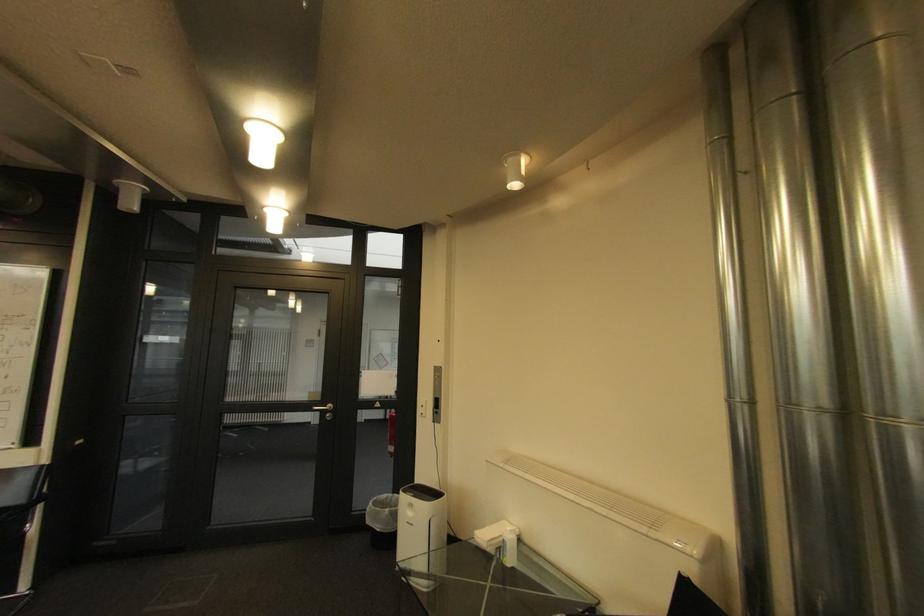
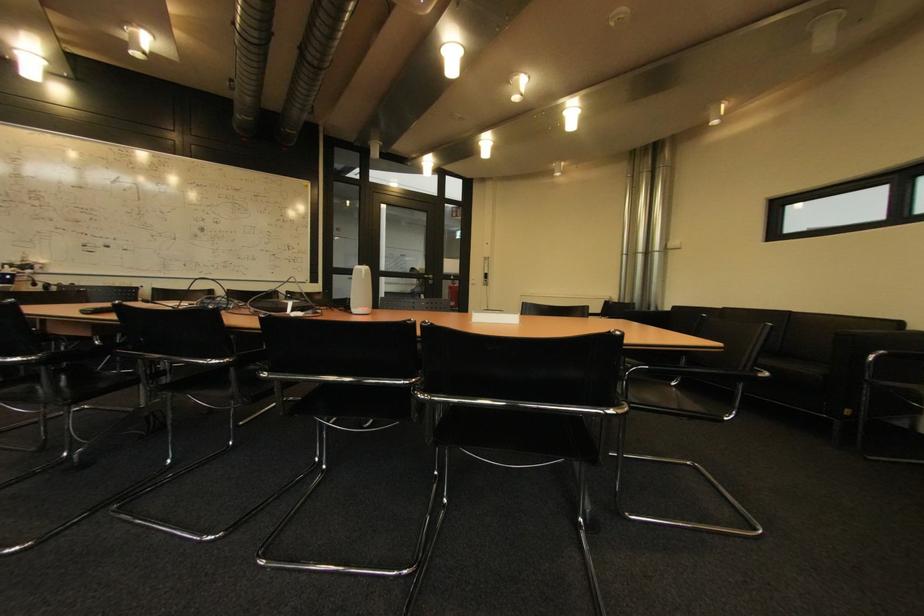
Which direction would the cameraman need to move to produce the second image?

The cameraman moved toward left, backward.